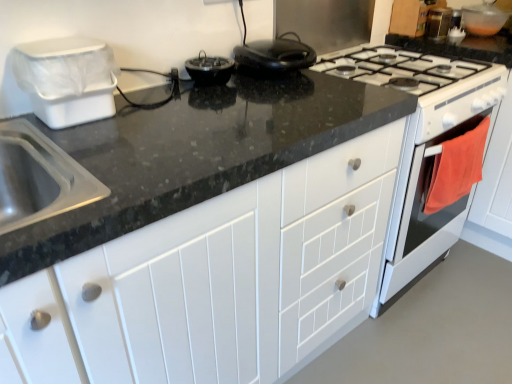
Image resolution: width=512 pixels, height=384 pixels. Identify the location of free spot to the right of metallic silver toaster at upper right, arranged as the 2th appliance when viewed from the right. (483, 39).